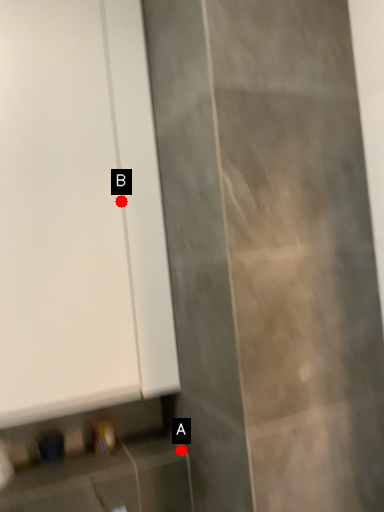
Question: Two points are circled on the image, labeled by A and B beside each circle. Which point appears farthest from the camera in this image?

Choices:
 (A) A is further
 (B) B is further

Answer: (A)